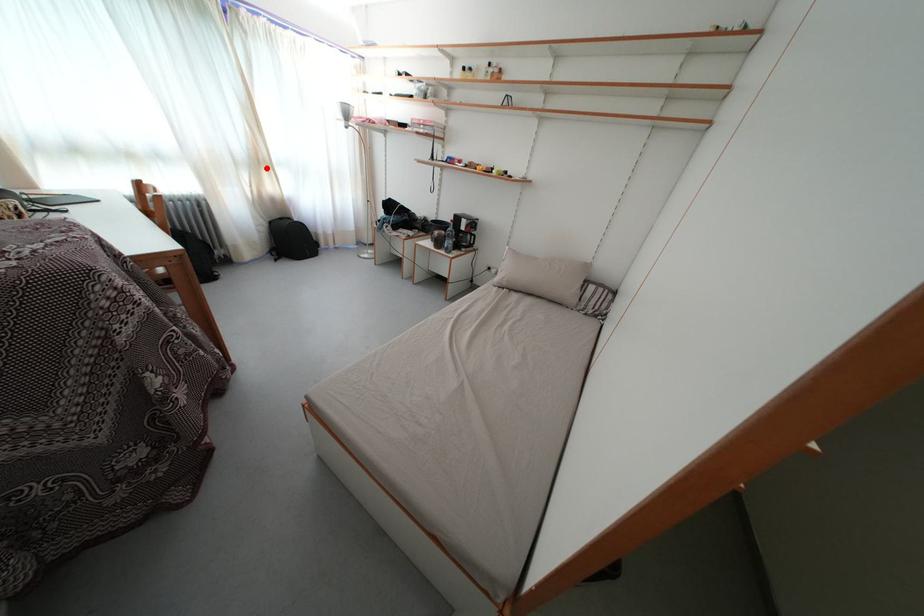
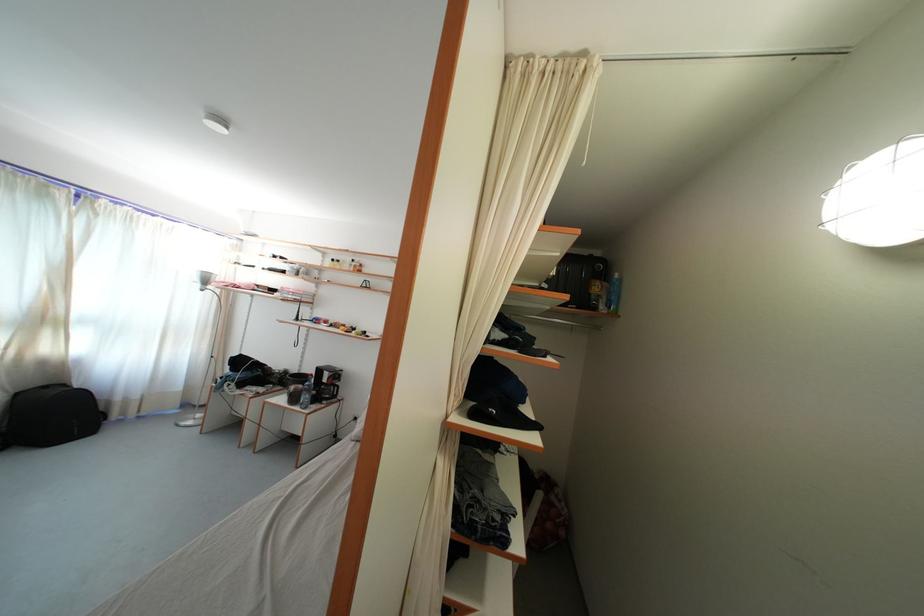
Locate, in the second image, the point that corresponds to the highlighted location in the first image.

(52, 326)